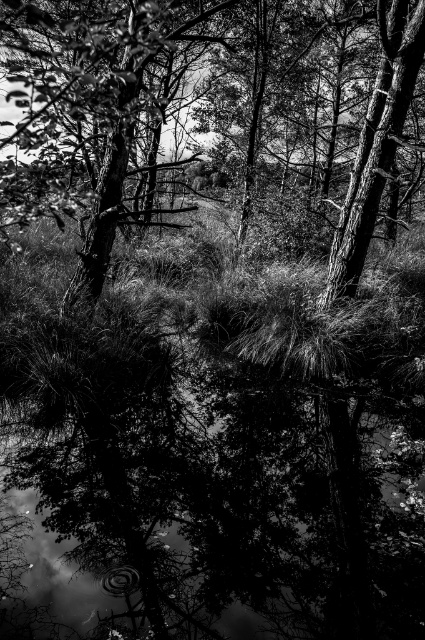
You are an observer standing in the forest scene. You see the smooth bark tree at center and the smooth bark tree at upper right. Which tree is closer to you?

The smooth bark tree at center is closer to you because it is in front of the smooth bark tree at upper right.

You are a photographer standing in the forest scene. You want to capture a photo that includes both the transparent water at center and the smooth bark tree at upper right. Based on their positions, will the tree appear reflected in the water?

The transparent water at center is below the smooth bark tree at upper right, so the tree should be reflected in the water since the water is positioned directly beneath it.

You are a photographer who wants to capture the smooth bark tree at center and the smooth bark tree at upper right in the same frame. Which tree should you focus on first if you want to ensure both are in focus?

The smooth bark tree at center is wider than the smooth bark tree at upper right, so focusing on the wider tree first will help ensure both are in focus.